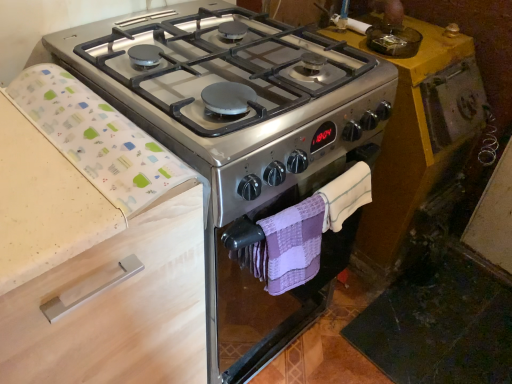
Question: Does purple woven hand towel at lower center, which is the 1th hand towel in left-to-right order, appear on the right side of white fabric at left?

Choices:
 (A) yes
 (B) no

Answer: (A)

Question: Is purple woven hand towel at lower center, which is the 1th hand towel in left-to-right order, beside white fabric at left?

Choices:
 (A) yes
 (B) no

Answer: (B)

Question: From a real-world perspective, is purple woven hand towel at lower center, which is the 1th hand towel in left-to-right order, on top of white fabric at left?

Choices:
 (A) yes
 (B) no

Answer: (B)

Question: Is purple woven hand towel at lower center, which is the second hand towel from right to left, located outside white fabric at left?

Choices:
 (A) yes
 (B) no

Answer: (A)

Question: From a real-world perspective, is purple woven hand towel at lower center, which is the second hand towel from right to left, located beneath white fabric at left?

Choices:
 (A) yes
 (B) no

Answer: (A)

Question: Is purple woven hand towel at lower center, which is the 1th hand towel in left-to-right order, taller than white fabric at left?

Choices:
 (A) no
 (B) yes

Answer: (B)

Question: From a real-world perspective, is purple woven hand towel at lower center, which is the 1th hand towel in left-to-right order, physically below purple woven hand towel at center, the 2th hand towel viewed from the left?

Choices:
 (A) no
 (B) yes

Answer: (B)

Question: Can you see purple woven hand towel at lower center, which is the 1th hand towel in left-to-right order, touching purple woven hand towel at center, the 2th hand towel viewed from the left?

Choices:
 (A) no
 (B) yes

Answer: (B)

Question: Is purple woven hand towel at lower center, which is the second hand towel from right to left, further to the viewer compared to purple woven hand towel at center, the 2th hand towel viewed from the left?

Choices:
 (A) yes
 (B) no

Answer: (B)

Question: Could you tell me if purple woven hand towel at lower center, which is the second hand towel from right to left, is facing purple woven hand towel at center, the 2th hand towel viewed from the left?

Choices:
 (A) no
 (B) yes

Answer: (A)

Question: Can you confirm if purple woven hand towel at lower center, which is the 1th hand towel in left-to-right order, is smaller than purple woven hand towel at center, the 2th hand towel viewed from the left?

Choices:
 (A) yes
 (B) no

Answer: (B)

Question: Can you confirm if purple woven hand towel at lower center, which is the 1th hand towel in left-to-right order, is taller than purple woven hand towel at center, the 2th hand towel viewed from the left?

Choices:
 (A) yes
 (B) no

Answer: (A)

Question: Does satin silver gas stove at center have a lesser width compared to beige wood drawer at left?

Choices:
 (A) no
 (B) yes

Answer: (A)